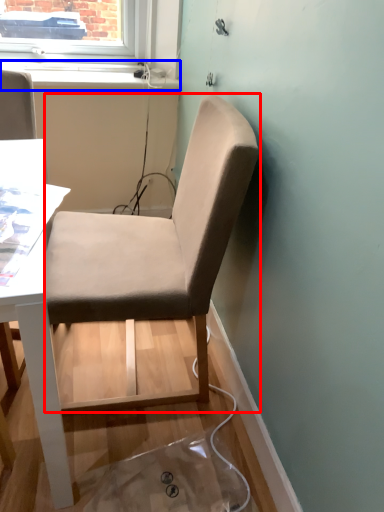
Question: Among these objects, which one is nearest to the camera, chair (highlighted by a red box) or window sill (highlighted by a blue box)?

Choices:
 (A) chair
 (B) window sill

Answer: (A)